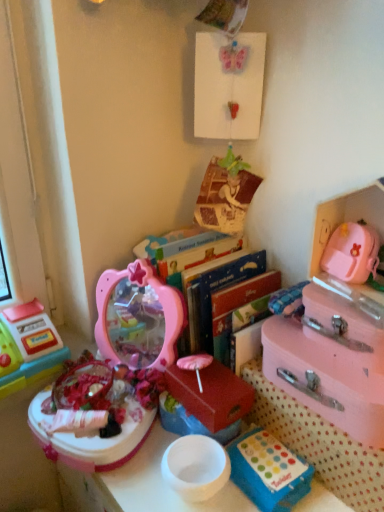
What is the approximate width of plastic toy cash register at left, the 2th toy viewed from the right?

5.81 inches.

Locate an element on the screen. pink matte suitcase at right, the 4th storage box positioned from the left is located at coordinates point(332,358).

Describe the element at coordinates (268, 471) in the screenshot. I see `blue plastic storage box at lower center, the 2th storage box positioned from the left` at that location.

At what (x,y) coordinates should I click in order to perform the action: click on blue plastic storage box at lower center, acting as the 3th storage box starting from the right. Please return your answer as a coordinate pair (x, y). The height and width of the screenshot is (512, 384). Looking at the image, I should click on (268, 471).

Where is `hardcover books at center`? The image size is (384, 512). hardcover books at center is located at coordinates (211, 284).

What is the approximate height of matte red box at center, the 1th storage box in the left-to-right sequence?

matte red box at center, the 1th storage box in the left-to-right sequence, is 4.52 inches in height.

Describe the element at coordinates (137, 318) in the screenshot. I see `pink plastic mirror at center, the 1th toy positioned from the right` at that location.

I want to click on plastic toy cash register at left, the first toy in the left-to-right sequence, so click(28, 346).

Is pink matte suitcase at right, the 4th storage box positioned from the left, oriented towards blue plastic storage box at lower center, the 2th storage box positioned from the left?

No, pink matte suitcase at right, the 4th storage box positioned from the left, does not turn towards blue plastic storage box at lower center, the 2th storage box positioned from the left.

Does pink matte suitcase at right, the 4th storage box positioned from the left, have a lesser height compared to blue plastic storage box at lower center, acting as the 3th storage box starting from the right?

No.

Is pink matte suitcase at right, the 4th storage box positioned from the left, placed right next to blue plastic storage box at lower center, the 2th storage box positioned from the left?

No, pink matte suitcase at right, the 4th storage box positioned from the left, is not making contact with blue plastic storage box at lower center, the 2th storage box positioned from the left.

In the image, is pastel pink suitcase at right, which is the third storage box in left-to-right order, on the left side or the right side of pink plastic mirror at center, the 1th toy positioned from the right?

pastel pink suitcase at right, which is the third storage box in left-to-right order, is positioned on pink plastic mirror at center, the 1th toy positioned from the right,'s right side.

This screenshot has height=512, width=384. Identify the location of toy in front of the pastel pink suitcase at right, which is the third storage box in left-to-right order. (137, 318).

Can you confirm if pastel pink suitcase at right, the 2th storage box viewed from the right, is wider than pink plastic mirror at center, placed as the second toy when sorted from left to right?

Incorrect, the width of pastel pink suitcase at right, the 2th storage box viewed from the right, does not surpass that of pink plastic mirror at center, placed as the second toy when sorted from left to right.

The image size is (384, 512). I want to click on toy that is the 2nd object directly below the pink matte suitcase at right, the 4th storage box positioned from the left (from a real-world perspective), so click(28, 346).

Is plastic toy cash register at left, the first toy in the left-to-right sequence, at the back of pink matte suitcase at right, the 4th storage box positioned from the left?

No.

Can you confirm if pink matte suitcase at right, which appears as the 1th storage box when viewed from the right, is thinner than plastic toy cash register at left, the first toy in the left-to-right sequence?

No.

Considering the points (349, 313) and (44, 317), which point is in front, point (349, 313) or point (44, 317)?

Positioned in front is point (349, 313).

Could you tell me if pastel pink suitcase at right, which is the third storage box in left-to-right order, is turned towards hardcover books at center?

No, pastel pink suitcase at right, which is the third storage box in left-to-right order, is not turned towards hardcover books at center.

Based on the photo, is pastel pink suitcase at right, the 2th storage box viewed from the right, inside the boundaries of hardcover books at center, or outside?

pastel pink suitcase at right, the 2th storage box viewed from the right, is not enclosed by hardcover books at center.

From a real-world perspective, is pastel pink suitcase at right, the 2th storage box viewed from the right, over hardcover books at center?

Actually, pastel pink suitcase at right, the 2th storage box viewed from the right, is physically below hardcover books at center in the real world.

Between pastel pink suitcase at right, the 2th storage box viewed from the right, and hardcover books at center, which one has larger size?

Bigger between the two is hardcover books at center.

Is matte red box at center, the 1th storage box in the left-to-right sequence, at the right side of pastel pink suitcase at right, the 2th storage box viewed from the right?

No.

Can you confirm if matte red box at center, the 4th storage box in the right-to-left sequence, is bigger than pastel pink suitcase at right, the 2th storage box viewed from the right?

No, matte red box at center, the 4th storage box in the right-to-left sequence, is not bigger than pastel pink suitcase at right, the 2th storage box viewed from the right.

From a real-world perspective, is matte red box at center, the 1th storage box in the left-to-right sequence, physically located above or below pastel pink suitcase at right, which is the third storage box in left-to-right order?

From a real-world perspective, matte red box at center, the 1th storage box in the left-to-right sequence, is physically above pastel pink suitcase at right, which is the third storage box in left-to-right order.

Does matte red box at center, the 4th storage box in the right-to-left sequence, have a lesser width compared to pastel pink suitcase at right, which is the third storage box in left-to-right order?

Correct, the width of matte red box at center, the 4th storage box in the right-to-left sequence, is less than that of pastel pink suitcase at right, which is the third storage box in left-to-right order.

Visually, is pink plastic mirror at center, the 1th toy positioned from the right, positioned to the left or to the right of pink matte suitcase at right, the 4th storage box positioned from the left?

Clearly, pink plastic mirror at center, the 1th toy positioned from the right, is on the left of pink matte suitcase at right, the 4th storage box positioned from the left, in the image.

From the image's perspective, does pink plastic mirror at center, placed as the second toy when sorted from left to right, appear higher than pink matte suitcase at right, the 4th storage box positioned from the left?

Yes, from the image's perspective, pink plastic mirror at center, placed as the second toy when sorted from left to right, is on top of pink matte suitcase at right, the 4th storage box positioned from the left.

Where is `the 4th storage box to the right of the pink plastic mirror at center, placed as the second toy when sorted from left to right, counting from the anchor's position`? This screenshot has width=384, height=512. the 4th storage box to the right of the pink plastic mirror at center, placed as the second toy when sorted from left to right, counting from the anchor's position is located at coordinates (332, 358).

How much distance is there between pink plastic mirror at center, placed as the second toy when sorted from left to right, and pink matte suitcase at right, which appears as the 1th storage box when viewed from the right?

12.67 inches.

Could you measure the distance between pastel pink suitcase at right, which is the third storage box in left-to-right order, and blue plastic storage box at lower center, the 2th storage box positioned from the left?

pastel pink suitcase at right, which is the third storage box in left-to-right order, and blue plastic storage box at lower center, the 2th storage box positioned from the left, are 7.12 centimeters apart.

From the image's perspective, which storage box is the 1st one above the blue plastic storage box at lower center, acting as the 3th storage box starting from the right? Please provide its 2D coordinates.

[(319, 444)]

Considering the positions of point (324, 450) and point (269, 433), is point (324, 450) closer or farther from the camera than point (269, 433)?

Point (324, 450) is positioned closer to the camera compared to point (269, 433).

From a real-world perspective, starting from the pink matte suitcase at right, which appears as the 1th storage box when viewed from the right, which storage box is the 3rd one below it? Please provide its 2D coordinates.

[(268, 471)]

Locate an element on the screen. the 1st storage box behind when counting from the pink plastic mirror at center, placed as the second toy when sorted from left to right is located at coordinates (319, 444).

Based on their spatial positions, is hardcover books at center or pastel pink suitcase at right, the 2th storage box viewed from the right, further from pink plastic mirror at center, the 1th toy positioned from the right?

The object further to pink plastic mirror at center, the 1th toy positioned from the right, is pastel pink suitcase at right, the 2th storage box viewed from the right.

Considering their positions, is pink matte suitcase at right, the 4th storage box positioned from the left, positioned closer to hardcover books at center than plastic toy cash register at left, the first toy in the left-to-right sequence?

pink matte suitcase at right, the 4th storage box positioned from the left, is closer to hardcover books at center.

Based on their spatial positions, is plastic toy cash register at left, the first toy in the left-to-right sequence, or blue plastic storage box at lower center, the 2th storage box positioned from the left, further from pink plastic mirror at center, the 1th toy positioned from the right?

blue plastic storage box at lower center, the 2th storage box positioned from the left, is further to pink plastic mirror at center, the 1th toy positioned from the right.

When comparing their distances from pink matte suitcase at right, the 4th storage box positioned from the left, does pastel pink suitcase at right, which is the third storage box in left-to-right order, or blue plastic storage box at lower center, acting as the 3th storage box starting from the right, seem further?

blue plastic storage box at lower center, acting as the 3th storage box starting from the right, lies further to pink matte suitcase at right, the 4th storage box positioned from the left, than the other object.

From the image, which object appears to be nearer to pink matte suitcase at right, the 4th storage box positioned from the left, hardcover books at center or matte red box at center, the 1th storage box in the left-to-right sequence?

Among the two, matte red box at center, the 1th storage box in the left-to-right sequence, is located nearer to pink matte suitcase at right, the 4th storage box positioned from the left.

Based on their spatial positions, is blue plastic storage box at lower center, the 2th storage box positioned from the left, or plastic toy cash register at left, the first toy in the left-to-right sequence, further from pink plastic mirror at center, the 1th toy positioned from the right?

blue plastic storage box at lower center, the 2th storage box positioned from the left, lies further to pink plastic mirror at center, the 1th toy positioned from the right, than the other object.

From the image, which object appears to be nearer to pastel pink suitcase at right, which is the third storage box in left-to-right order, hardcover books at center or pink plastic mirror at center, the 1th toy positioned from the right?

hardcover books at center is positioned closer to the anchor pastel pink suitcase at right, which is the third storage box in left-to-right order.

Based on their spatial positions, is plastic toy cash register at left, the first toy in the left-to-right sequence, or blue plastic storage box at lower center, acting as the 3th storage box starting from the right, further from matte red box at center, the 4th storage box in the right-to-left sequence?

Based on the image, plastic toy cash register at left, the first toy in the left-to-right sequence, appears to be further to matte red box at center, the 4th storage box in the right-to-left sequence.

Locate an element on the screen. toy situated between plastic toy cash register at left, the 2th toy viewed from the right, and hardcover books at center from left to right is located at coordinates (x=137, y=318).

At what (x,y) coordinates should I click in order to perform the action: click on storage box between plastic toy cash register at left, the 2th toy viewed from the right, and blue plastic storage box at lower center, acting as the 3th storage box starting from the right. Please return your answer as a coordinate pair (x, y). Image resolution: width=384 pixels, height=512 pixels. Looking at the image, I should click on (211, 394).

Identify the location of bookshelf between matte red box at center, the 1th storage box in the left-to-right sequence, and pastel pink suitcase at right, the 2th storage box viewed from the right, from left to right. The height and width of the screenshot is (512, 384). (211, 284).

You are a GUI agent. You are given a task and a screenshot of the screen. Output one action in this format:
    pyautogui.click(x=<x>, y=<y>)
    Task: Click on the storage box between plastic toy cash register at left, the first toy in the left-to-right sequence, and hardcover books at center
    The width and height of the screenshot is (384, 512).
    Given the screenshot: What is the action you would take?
    pyautogui.click(x=211, y=394)